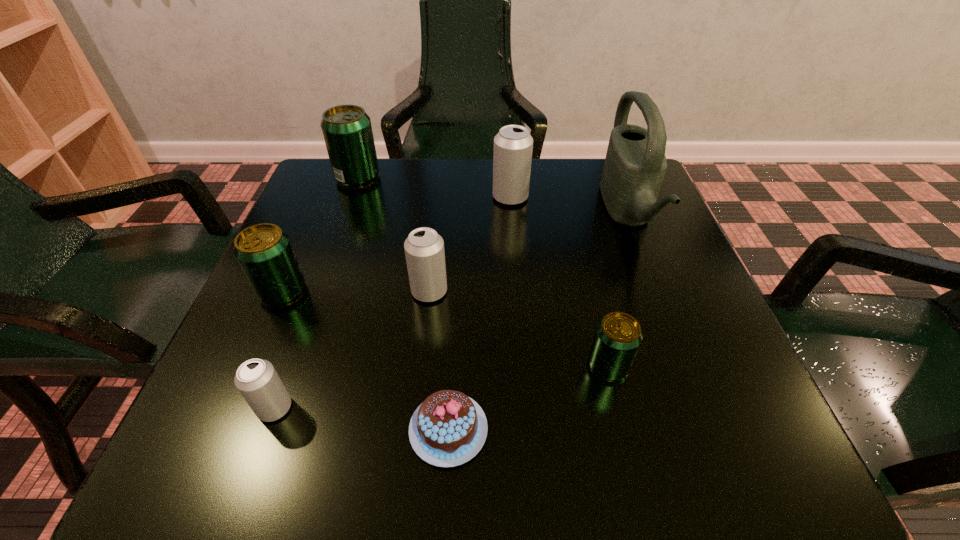
You are a GUI agent. You are given a task and a screenshot of the screen. Output one action in this format:
    pyautogui.click(x=<x>, y=<y>)
    Task: Click on the vacant point located on the back of the second farthest green beer can
    This screenshot has width=960, height=540.
    Given the screenshot: What is the action you would take?
    pyautogui.click(x=335, y=170)

Where is `vacant space located on the left of the nearest green beer can`? The height and width of the screenshot is (540, 960). vacant space located on the left of the nearest green beer can is located at coordinates (424, 366).

I want to click on free space located on the back of the leftmost white beer can, so click(322, 276).

Identify the location of vacant space located on the back of the pink chocolate cake. (457, 271).

Find the location of a particular element. watering can situated at the far edge is located at coordinates (635, 165).

This screenshot has height=540, width=960. What are the coordinates of `beer can at the near edge` in the screenshot? It's located at (256, 379).

You are a GUI agent. You are given a task and a screenshot of the screen. Output one action in this format:
    pyautogui.click(x=<x>, y=<y>)
    Task: Click on the chocolate cake that is at the near edge
    The width and height of the screenshot is (960, 540).
    Given the screenshot: What is the action you would take?
    pyautogui.click(x=449, y=428)

Locate an element on the screen. This screenshot has width=960, height=540. object at the right edge is located at coordinates (635, 165).

Identify the location of object at the far left corner. point(347,131).

The image size is (960, 540). Find the location of `object at the near left corner`. object at the near left corner is located at coordinates (256, 379).